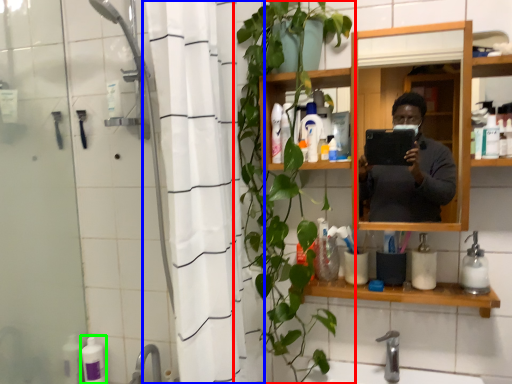
Question: Based on their relative distances, which object is farther from houseplant (highlighted by a red box)? Choose from shower curtain (highlighted by a blue box) and toiletry (highlighted by a green box).

Choices:
 (A) shower curtain
 (B) toiletry

Answer: (B)